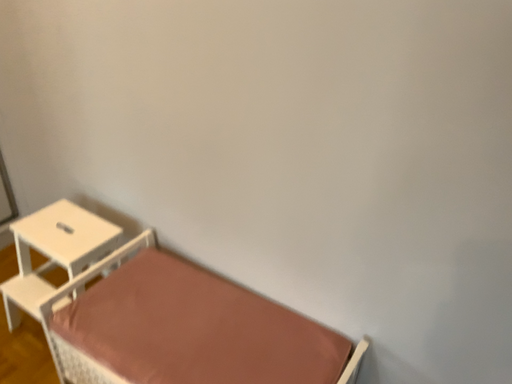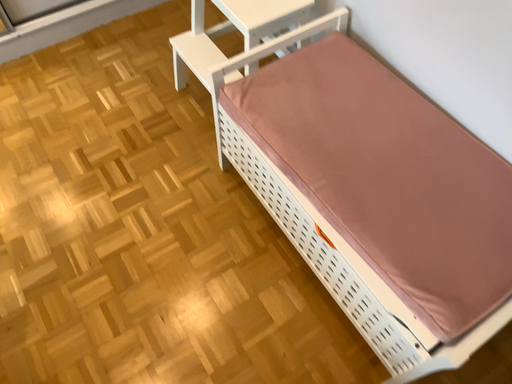
Question: Which way did the camera rotate in the video?

Choices:
 (A) rotated right
 (B) rotated left

Answer: (B)